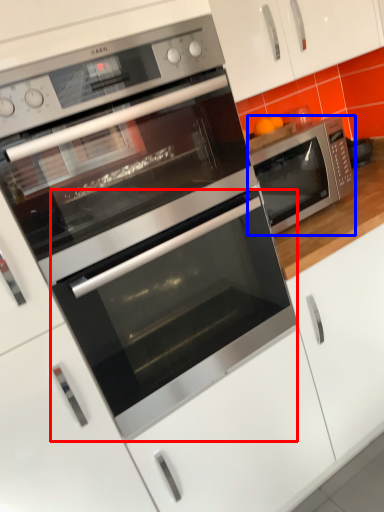
Question: Which object appears farthest to the camera in this image, oven (highlighted by a red box) or microwave oven (highlighted by a blue box)?

Choices:
 (A) oven
 (B) microwave oven

Answer: (B)